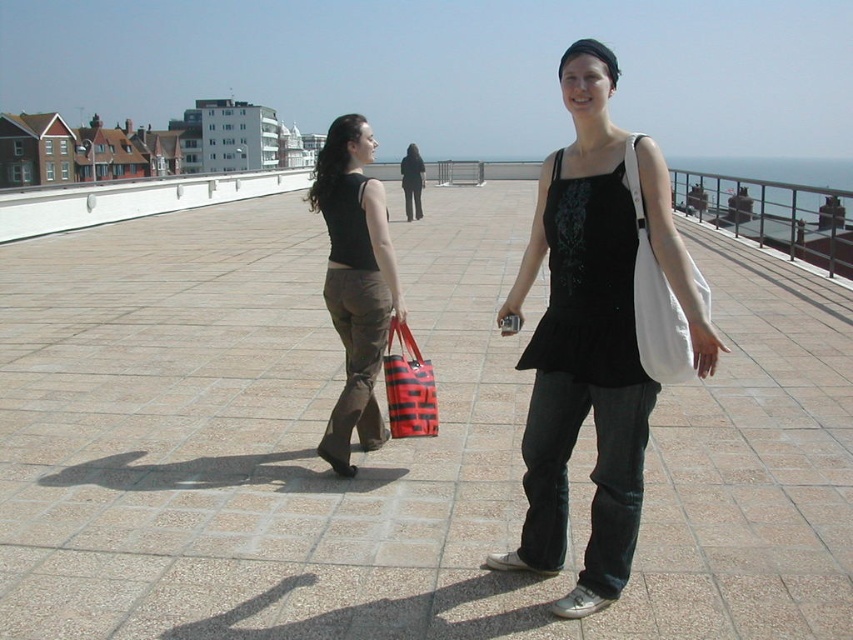
Does matte black tank top at center appear on the right side of white fabric bag at center?

Indeed, matte black tank top at center is positioned on the right side of white fabric bag at center.

Can you confirm if matte black tank top at center is wider than white fabric bag at center?

Correct, the width of matte black tank top at center exceeds that of white fabric bag at center.

Does point (630, 406) come in front of point (653, 284)?

No, it is not.

The image size is (853, 640). I want to click on matte black tank top at center, so click(x=593, y=333).

Between brown textured pavement at center and matte black tank top at center, which one appears on the left side from the viewer's perspective?

From the viewer's perspective, brown textured pavement at center appears more on the left side.

I want to click on brown textured pavement at center, so click(x=387, y=444).

Locate an element on the screen. brown textured pavement at center is located at coordinates (387, 444).

Does brown textured pavement at center have a smaller size compared to red striped fabric bag at center?

Actually, brown textured pavement at center might be larger than red striped fabric bag at center.

Does brown textured pavement at center appear over red striped fabric bag at center?

Indeed, brown textured pavement at center is positioned over red striped fabric bag at center.

Image resolution: width=853 pixels, height=640 pixels. Describe the element at coordinates (387, 444) in the screenshot. I see `brown textured pavement at center` at that location.

The width and height of the screenshot is (853, 640). I want to click on brown textured pavement at center, so click(387, 444).